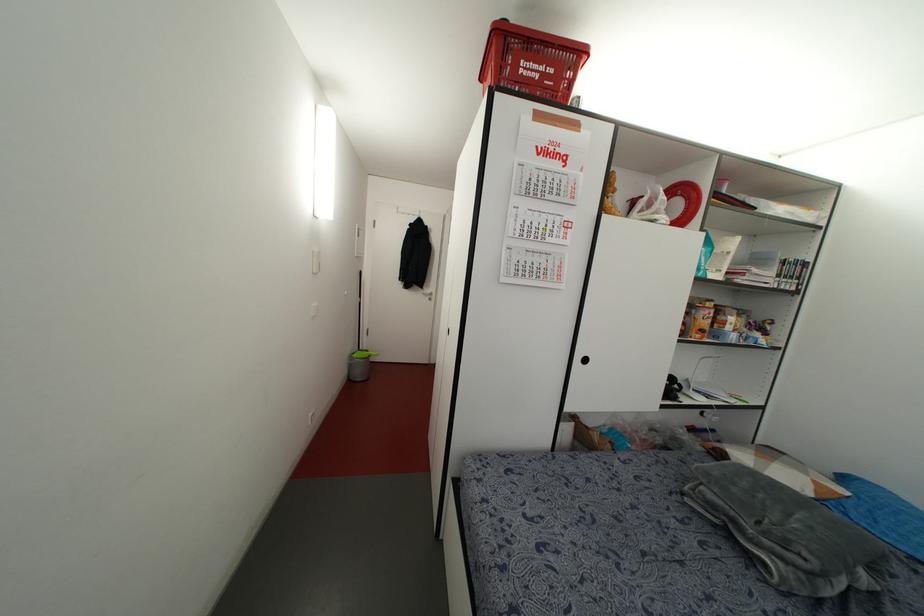
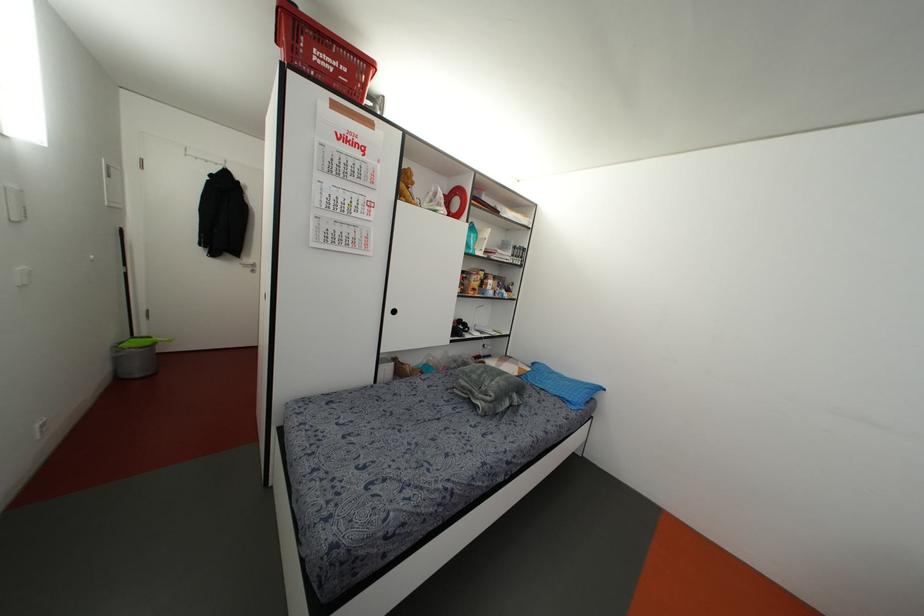
Where in the second image is the point corresponding to point 528,69 from the first image?

(322, 59)